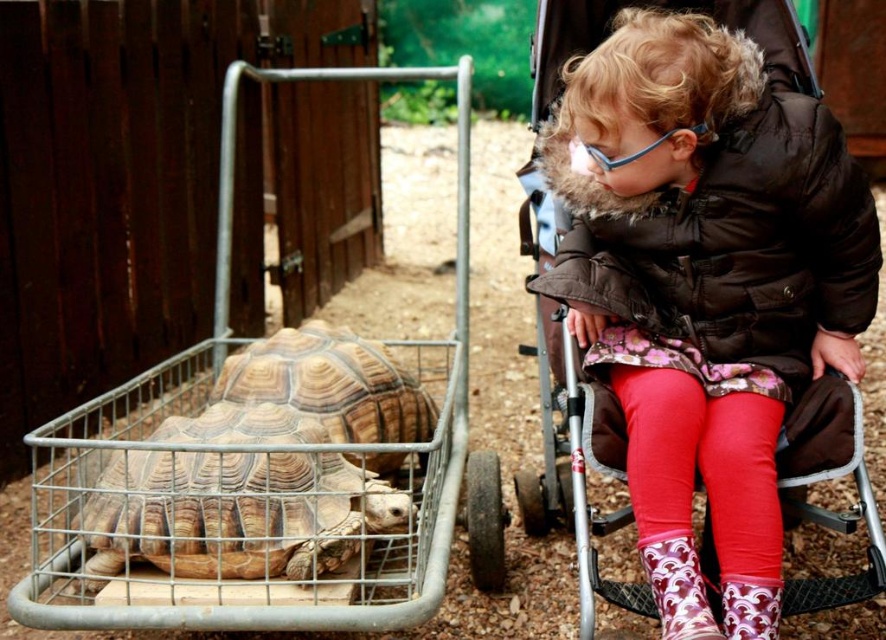
Does brown textured shell at center have a larger size compared to brown textured tortoise at left?

Yes.

Does brown textured shell at center have a lesser width compared to brown textured tortoise at left?

No.

Does point (165, 467) come behind point (289, 342)?

No, it is not.

Where is `brown textured shell at center`? Image resolution: width=886 pixels, height=640 pixels. brown textured shell at center is located at coordinates (235, 513).

Locate an element on the screen. fluffy brown coat at upper right is located at coordinates (717, 291).

Can you confirm if fluffy brown coat at upper right is taller than printed fabric boot at lower right?

Correct, fluffy brown coat at upper right is much taller as printed fabric boot at lower right.

Describe the element at coordinates (717, 291) in the screenshot. I see `fluffy brown coat at upper right` at that location.

In order to click on fluffy brown coat at upper right in this screenshot , I will do click(717, 291).

Is point (548, 296) behind point (149, 513)?

No, (548, 296) is in front of (149, 513).

Consider the image. How distant is fluffy brown coat at upper right from brown textured shell at center?

29.30 inches

Between point (684, 380) and point (195, 461), which one is positioned behind?

Point (195, 461)

Find the location of a particular element. The width and height of the screenshot is (886, 640). fluffy brown coat at upper right is located at coordinates (717, 291).